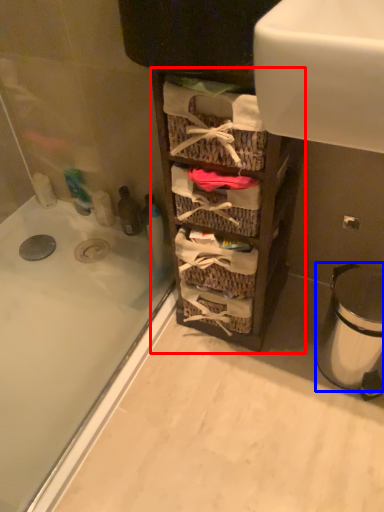
Question: Which of the following is the farthest to the observer, cabinetry (highlighted by a red box) or trash bin/can (highlighted by a blue box)?

Choices:
 (A) cabinetry
 (B) trash bin/can

Answer: (B)